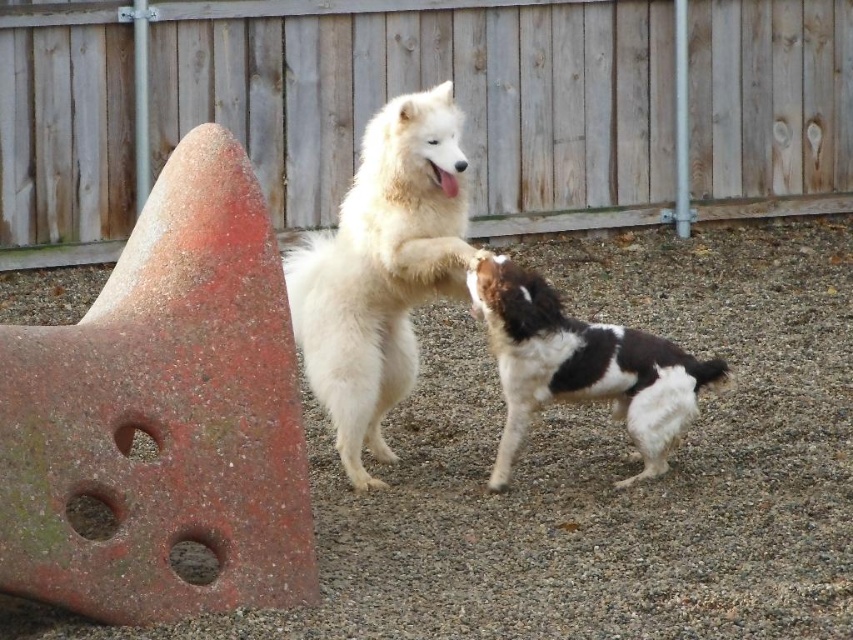
Question: Which of the following is the farthest from the observer?

Choices:
 (A) white fluffy dog at center
 (B) black and white fur dog at center

Answer: (A)

Question: Which point is closer to the camera?

Choices:
 (A) (486, 314)
 (B) (294, 282)
 (C) (39, 156)

Answer: (A)

Question: Can you confirm if wooden fence at upper center is smaller than white fluffy dog at center?

Choices:
 (A) yes
 (B) no

Answer: (B)

Question: Considering the real-world distances, which object is closest to the wooden fence at upper center?

Choices:
 (A) black and white fur dog at center
 (B) white fluffy dog at center

Answer: (B)

Question: Observing the image, what is the correct spatial positioning of white fluffy dog at center in reference to black and white fur dog at center?

Choices:
 (A) below
 (B) above

Answer: (B)

Question: Observing the image, what is the correct spatial positioning of wooden fence at upper center in reference to white fluffy dog at center?

Choices:
 (A) above
 (B) below

Answer: (A)